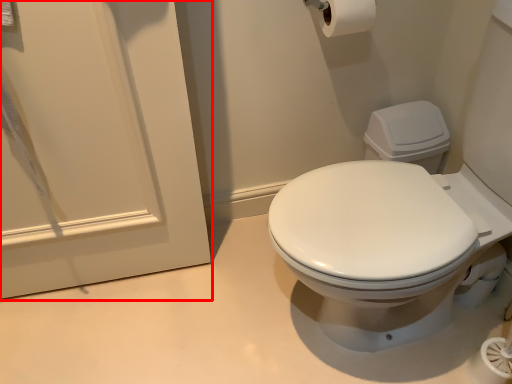
Question: From the image's perspective, where is screen door (annotated by the red box) located relative to toilet paper?

Choices:
 (A) above
 (B) below

Answer: (B)